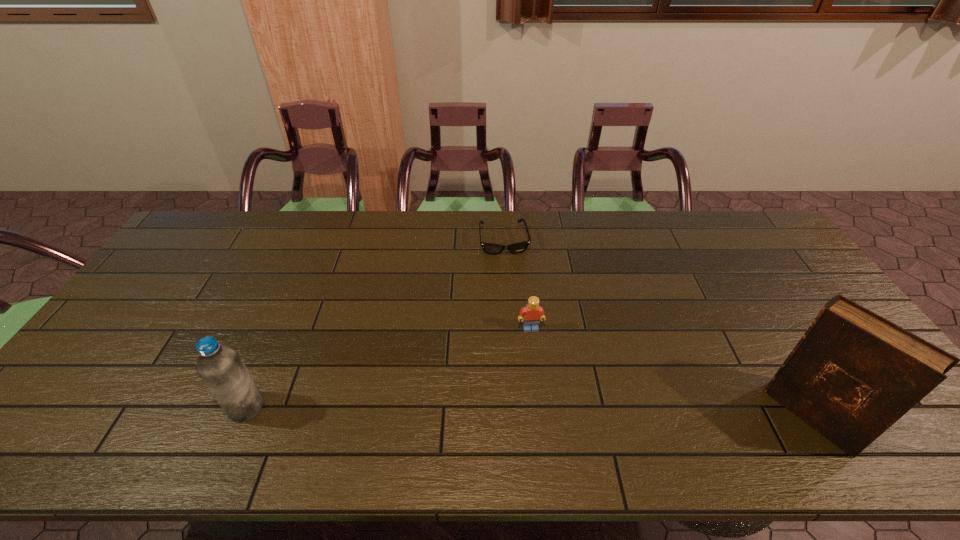
This screenshot has width=960, height=540. I want to click on vacant space on the desktop that is between the second tallest object and the Bible and is positioned on the front-facing side of the Lego, so click(x=546, y=411).

Locate an element on the screen. This screenshot has width=960, height=540. free space on the desktop that is between the leftmost object and the Bible and is positioned on the front-facing side of the sunglasses is located at coordinates (535, 411).